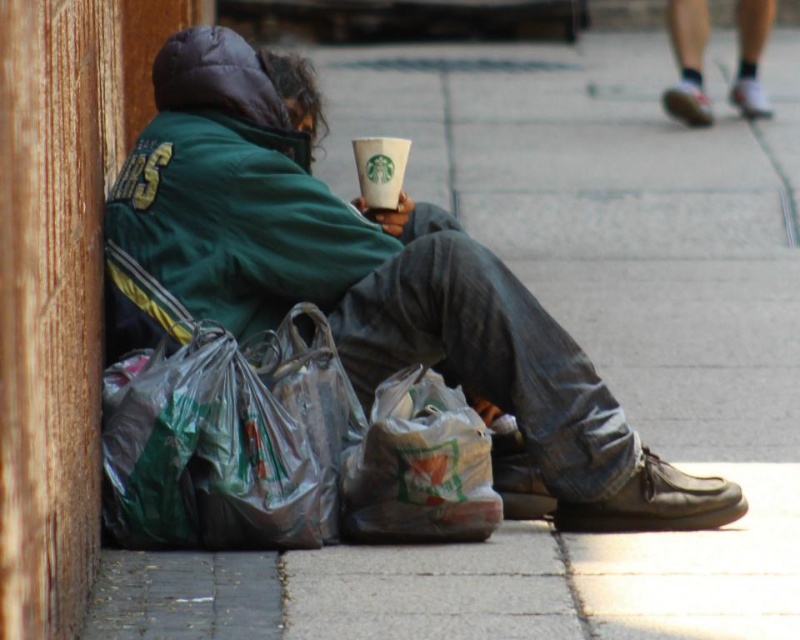
Question: Which of the following is the farthest from the observer?

Choices:
 (A) translucent plastic bag at lower center
 (B) green matte jacket at center
 (C) green fabric jacket at center

Answer: (B)

Question: Which of the following is the farthest from the observer?

Choices:
 (A) translucent plastic bag at lower center
 (B) green fabric jacket at center

Answer: (B)

Question: Is green fabric jacket at center positioned behind translucent plastic bag at lower center?

Choices:
 (A) no
 (B) yes

Answer: (B)

Question: Which of the following is the closest to the observer?

Choices:
 (A) green matte jacket at center
 (B) white paper cup at center
 (C) translucent plastic bag at lower center

Answer: (C)

Question: Does green fabric jacket at center have a lesser width compared to translucent plastic bag at lower center?

Choices:
 (A) no
 (B) yes

Answer: (A)

Question: Can you confirm if translucent plastic bag at lower center is smaller than white paper cup at center?

Choices:
 (A) yes
 (B) no

Answer: (B)